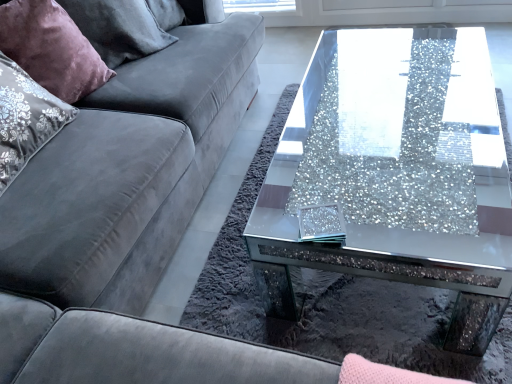
Question: From a real-world perspective, is sparkly glass coffee table at center under velvet grey couch at left?

Choices:
 (A) yes
 (B) no

Answer: (A)

Question: Is sparkly glass coffee table at center not close to velvet grey couch at left?

Choices:
 (A) no
 (B) yes

Answer: (A)

Question: Are sparkly glass coffee table at center and velvet grey couch at left making contact?

Choices:
 (A) no
 (B) yes

Answer: (A)

Question: From the image's perspective, is sparkly glass coffee table at center located above velvet grey couch at left?

Choices:
 (A) no
 (B) yes

Answer: (A)

Question: Is sparkly glass coffee table at center positioned with its back to velvet grey couch at left?

Choices:
 (A) yes
 (B) no

Answer: (A)

Question: Do you think velvet purple pillow at upper left is within velvet grey couch at left, or outside of it?

Choices:
 (A) outside
 (B) inside

Answer: (B)

Question: Would you say velvet purple pillow at upper left is to the left or to the right of velvet grey couch at left in the picture?

Choices:
 (A) left
 (B) right

Answer: (A)

Question: In the image, is velvet purple pillow at upper left positioned in front of or behind velvet grey couch at left?

Choices:
 (A) front
 (B) behind

Answer: (B)

Question: Considering the positions of velvet purple pillow at upper left and velvet grey couch at left in the image, is velvet purple pillow at upper left taller or shorter than velvet grey couch at left?

Choices:
 (A) short
 (B) tall

Answer: (A)

Question: Considering the positions of sparkly glass coffee table at center and velvet purple pillow at upper left in the image, is sparkly glass coffee table at center taller or shorter than velvet purple pillow at upper left?

Choices:
 (A) tall
 (B) short

Answer: (B)

Question: Based on their sizes in the image, would you say sparkly glass coffee table at center is bigger or smaller than velvet purple pillow at upper left?

Choices:
 (A) small
 (B) big

Answer: (B)

Question: Considering the positions of point 379,266 and point 62,16, is point 379,266 closer or farther from the camera than point 62,16?

Choices:
 (A) farther
 (B) closer

Answer: (B)

Question: In terms of width, does sparkly glass coffee table at center look wider or thinner when compared to velvet purple pillow at upper left?

Choices:
 (A) thin
 (B) wide

Answer: (B)

Question: Would you say velvet grey couch at left is to the left or to the right of sparkly glass coffee table at center in the picture?

Choices:
 (A) right
 (B) left

Answer: (B)

Question: From the image's perspective, is velvet grey couch at left above or below sparkly glass coffee table at center?

Choices:
 (A) below
 (B) above

Answer: (B)